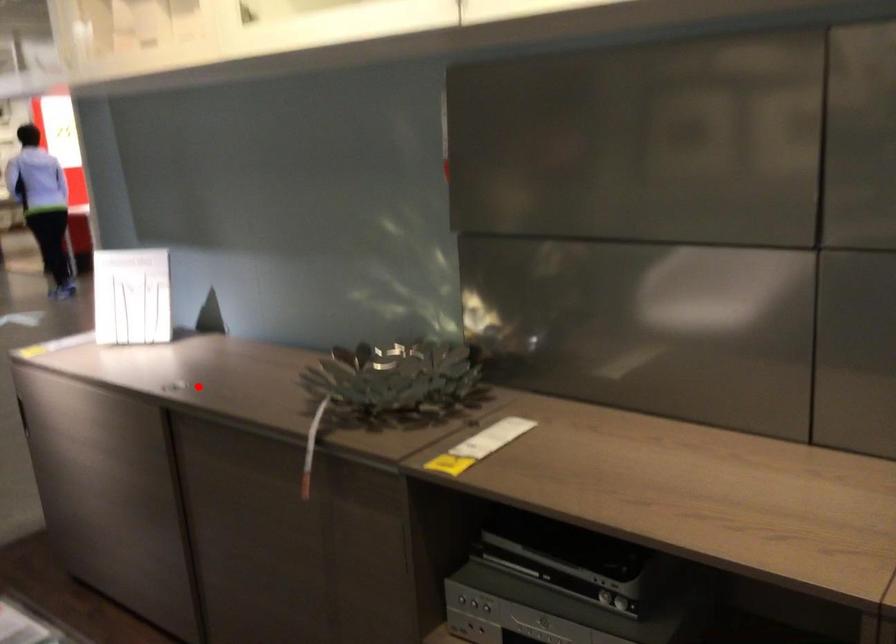
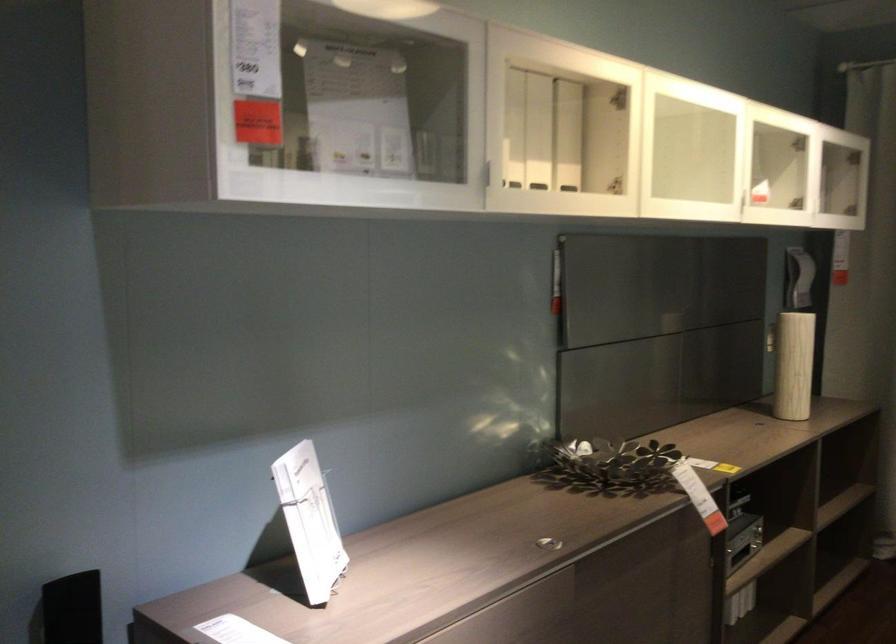
Find the pixel in the second image that matches the highlighted location in the first image.

(547, 543)